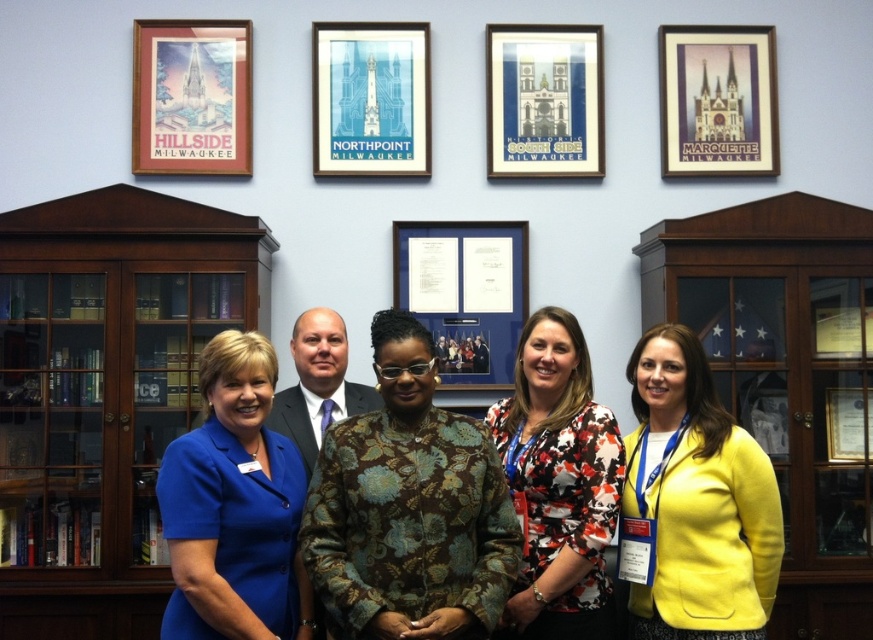
Question: Is blue paper picture frame at center below matte black suit at center?

Choices:
 (A) yes
 (B) no

Answer: (B)

Question: Is matte wood picture frame at upper left above blue paper picture frame at center?

Choices:
 (A) yes
 (B) no

Answer: (A)

Question: Which object is the farthest from the brown wood bookshelf at left?

Choices:
 (A) brown floral jacket at center
 (B) matte wood picture frame at upper left
 (C) yellow fabric jacket at lower right
 (D) floral print blouse at center

Answer: (C)

Question: Which of the following is the farthest from the observer?

Choices:
 (A) (175, 29)
 (B) (454, 257)

Answer: (A)

Question: Which object is the closest to the blue fabric dress at left?

Choices:
 (A) matte paper poster at upper right
 (B) white paper at center
 (C) floral print blouse at center

Answer: (C)

Question: From the image, what is the correct spatial relationship of brown wood bookshelf at left in relation to brown floral jacket at center?

Choices:
 (A) below
 (B) above

Answer: (B)